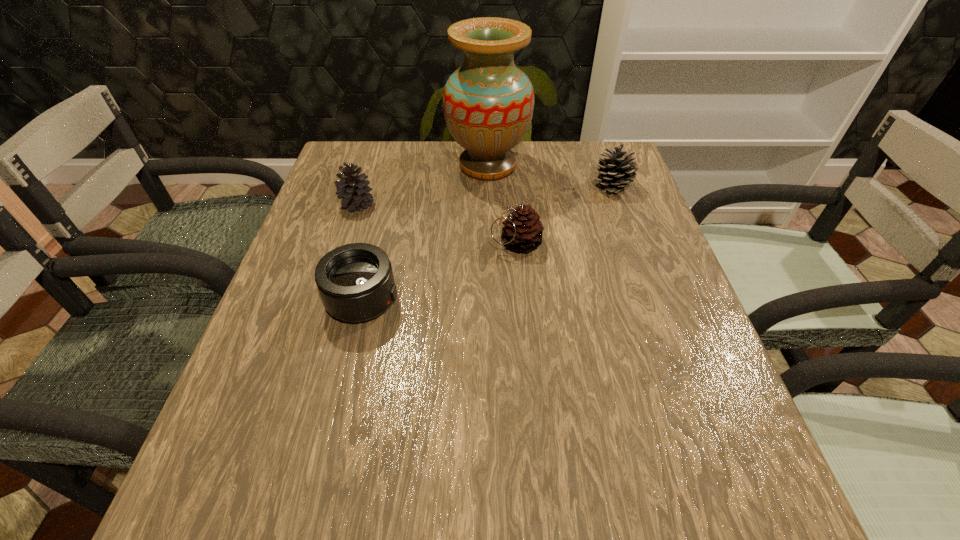
Identify the location of vacant space located 0.340m with a leaf charm attached to the second pinecone from left to right. (339, 242).

This screenshot has height=540, width=960. Identify the location of vacant space located 0.220m with a leaf charm attached to the second pinecone from left to right. (393, 242).

At what (x,y) coordinates should I click in order to perform the action: click on free spot located on the side of the telephoto lens with brand markings and control switches. Please return your answer as a coordinate pair (x, y). The height and width of the screenshot is (540, 960). Looking at the image, I should click on (561, 300).

Where is `vase situated at the far edge`? vase situated at the far edge is located at coordinates (488, 102).

Find the location of a particular element. The image size is (960, 540). pinecone that is at the far edge is located at coordinates (617, 169).

The width and height of the screenshot is (960, 540). I want to click on pinecone present at the left edge, so click(x=353, y=191).

Identify the location of telephoto lens that is at the left edge. The image size is (960, 540). (356, 283).

Identify the location of object present at the right edge. (617, 169).

The height and width of the screenshot is (540, 960). In order to click on object situated at the far right corner in this screenshot , I will do `click(617, 169)`.

At what (x,y) coordinates should I click in order to perform the action: click on free region at the far edge of the desktop. Please return your answer as a coordinate pair (x, y). Looking at the image, I should click on (434, 166).